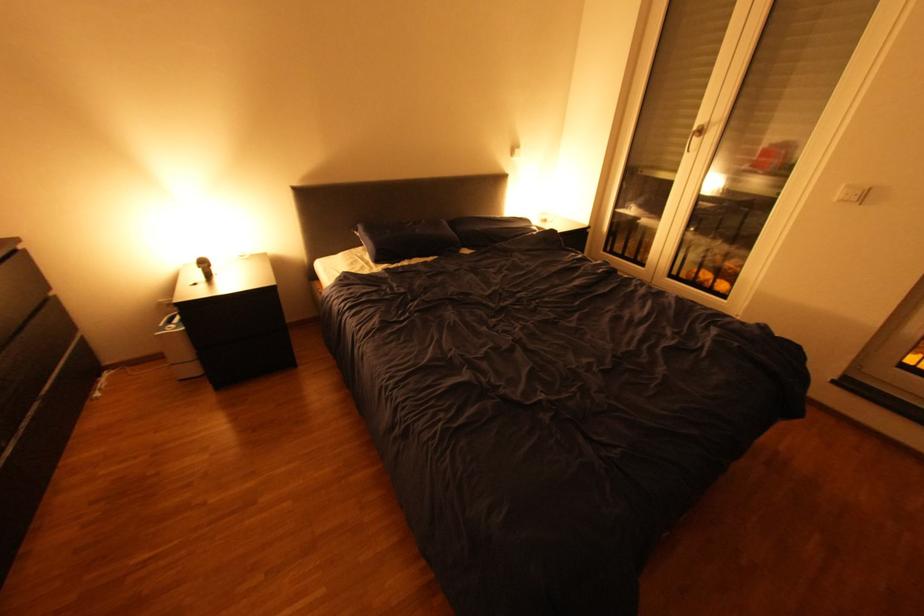
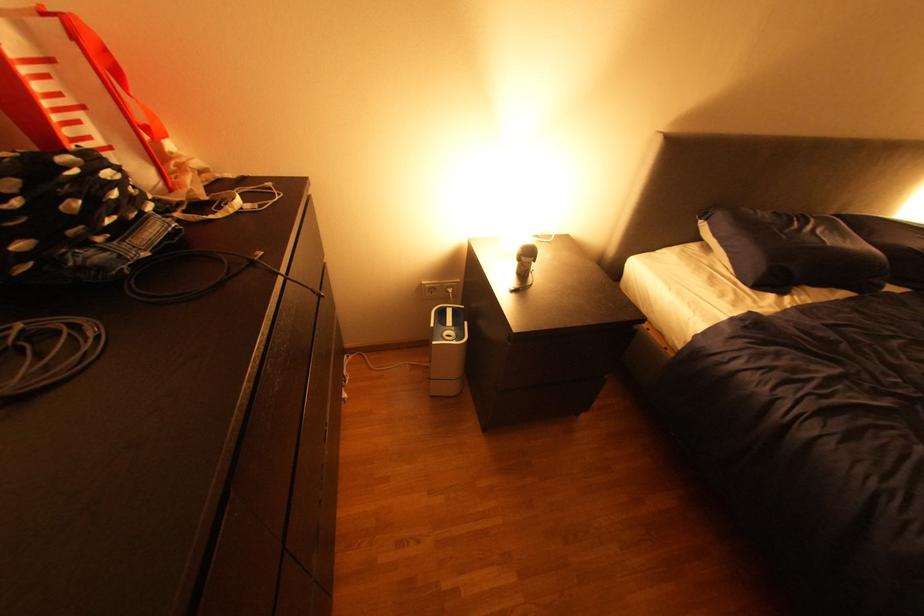
Which direction would the cameraman need to move to produce the second image?

The cameraman moved toward left, forward.